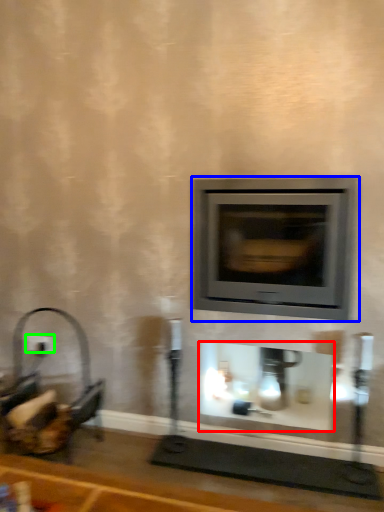
Question: Which object is the closest to the fireplace (highlighted by a red box)? Choose among these: wood burning stove (highlighted by a blue box) or electric outlet (highlighted by a green box).

Choices:
 (A) wood burning stove
 (B) electric outlet

Answer: (A)